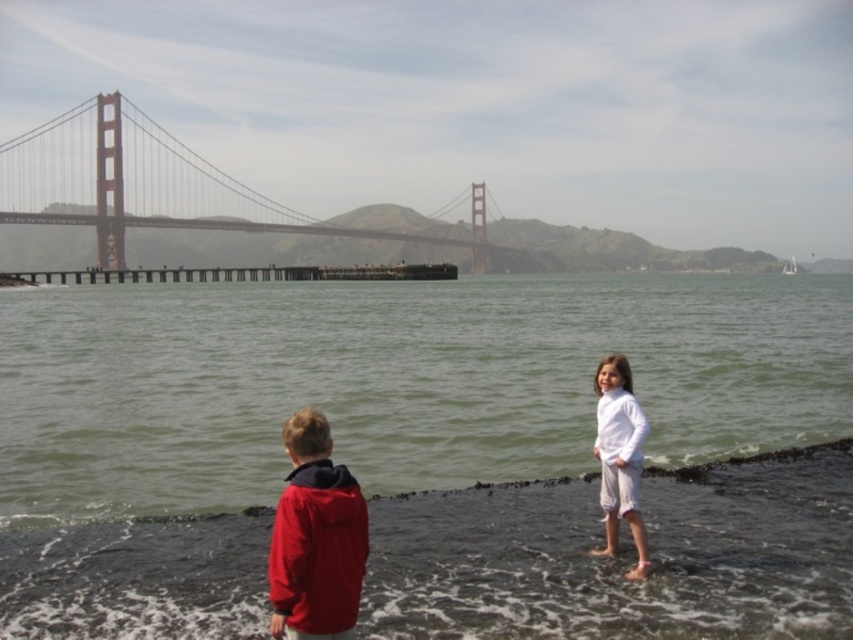
Which is below, metallic bridge at upper center or matte red jacket at lower left?

matte red jacket at lower left

Measure the distance between metallic bridge at upper center and camera.

metallic bridge at upper center is 120.52 meters from camera.

In order to click on metallic bridge at upper center in this screenshot , I will do `click(148, 186)`.

Does greenish water at lower center have a lesser width compared to matte red jacket at lower left?

No, greenish water at lower center is not thinner than matte red jacket at lower left.

Does greenish water at lower center appear on the right side of matte red jacket at lower left?

No, greenish water at lower center is not to the right of matte red jacket at lower left.

Who is more forward, (x=383, y=593) or (x=343, y=496)?

Point (x=343, y=496) is in front.

Identify the location of greenish water at lower center. The width and height of the screenshot is (853, 640). (424, 452).

Is greenish water at lower center smaller than metallic bridge at upper center?

Indeed, greenish water at lower center has a smaller size compared to metallic bridge at upper center.

Which of these two, greenish water at lower center or metallic bridge at upper center, stands shorter?

greenish water at lower center

Does point (16, 609) lie behind point (44, 184)?

No, it is in front of (44, 184).

At what (x,y) coordinates should I click in order to perform the action: click on greenish water at lower center. Please return your answer as a coordinate pair (x, y). This screenshot has width=853, height=640. Looking at the image, I should click on (424, 452).